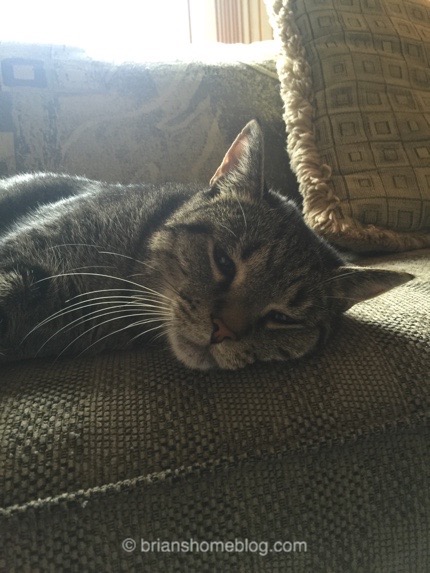
Where is `cat laying on couch`? cat laying on couch is located at coordinates (93, 238).